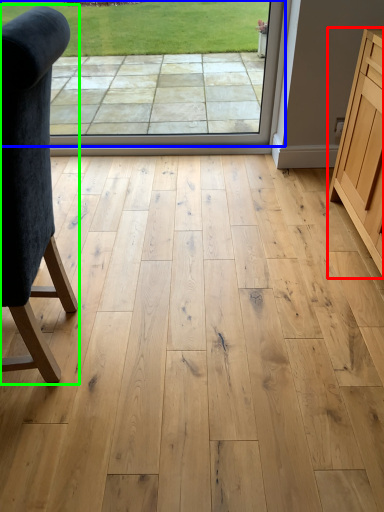
Question: Which is nearer to the cabinetry (highlighted by a red box)? window screen (highlighted by a blue box) or chair (highlighted by a green box).

Choices:
 (A) window screen
 (B) chair

Answer: (A)